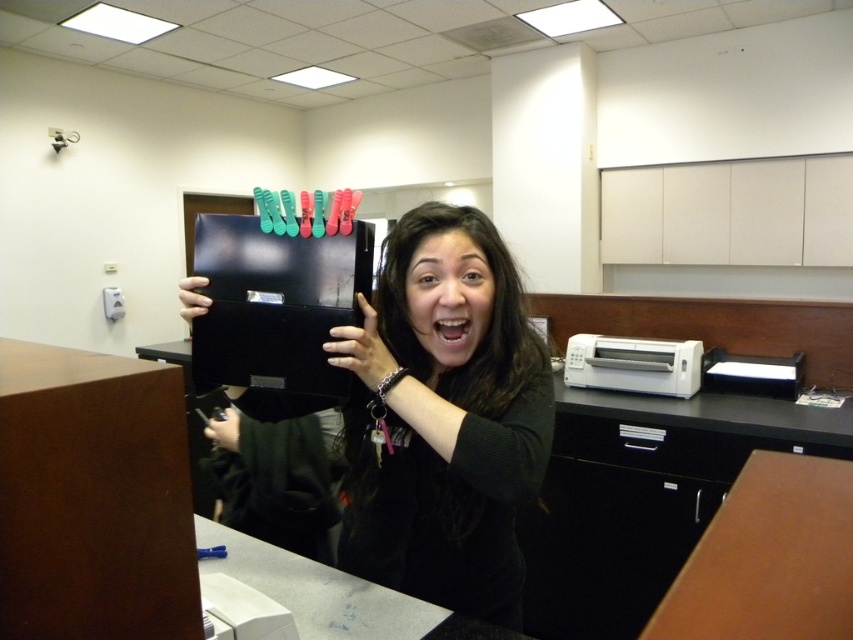
Which is more to the left, matte black folder at center or black matte file cabinet at lower right?

From the viewer's perspective, matte black folder at center appears more on the left side.

How far apart are matte black folder at center and black matte file cabinet at lower right?

A distance of 4.60 feet exists between matte black folder at center and black matte file cabinet at lower right.

Who is more distant from viewer, (439,227) or (579,413)?

The point (579,413) is behind.

At what (x,y) coordinates should I click in order to perform the action: click on matte black folder at center. Please return your answer as a coordinate pair (x, y). The width and height of the screenshot is (853, 640). Looking at the image, I should click on (444, 417).

Which is more to the left, black matte file cabinet at lower right or brown wood table at lower right?

From the viewer's perspective, brown wood table at lower right appears more on the left side.

Between point (624, 470) and point (735, 512), which one is positioned behind?

Point (624, 470)

Between point (593, 449) and point (763, 541), which one is positioned behind?

Point (593, 449)

The image size is (853, 640). Identify the location of black matte file cabinet at lower right. (643, 497).

Between matte black folder at center and brown wood table at lower right, which one has more height?

With more height is matte black folder at center.

Is point (364, 436) closer to camera compared to point (809, 620)?

No, it is behind (809, 620).

Which is in front, point (407, 412) or point (788, 456)?

Point (407, 412)

At what (x,y) coordinates should I click in order to perform the action: click on matte black folder at center. Please return your answer as a coordinate pair (x, y). The width and height of the screenshot is (853, 640). Looking at the image, I should click on (444, 417).